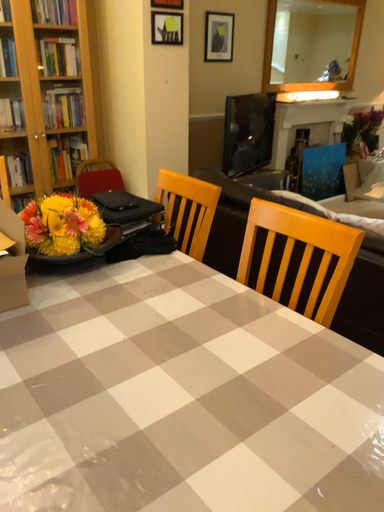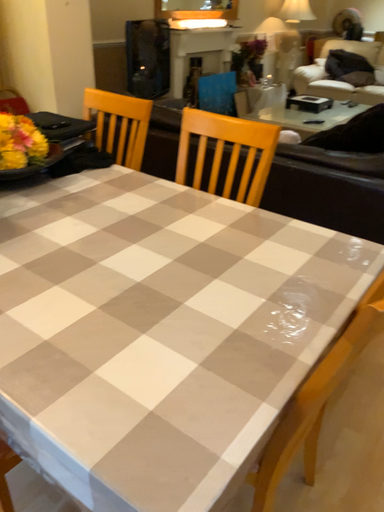
Question: Which way did the camera rotate in the video?

Choices:
 (A) rotated right
 (B) rotated left

Answer: (A)